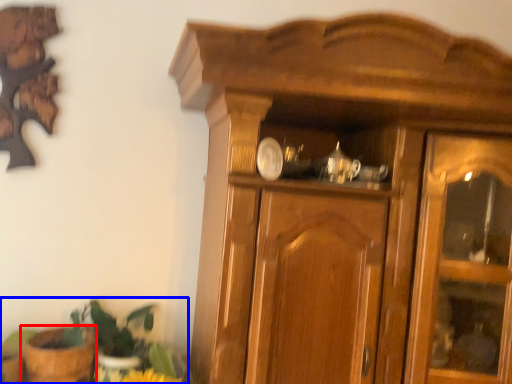
Question: Among these objects, which one is nearest to the camera, flowerpot (highlighted by a red box) or houseplant (highlighted by a blue box)?

Choices:
 (A) flowerpot
 (B) houseplant

Answer: (A)